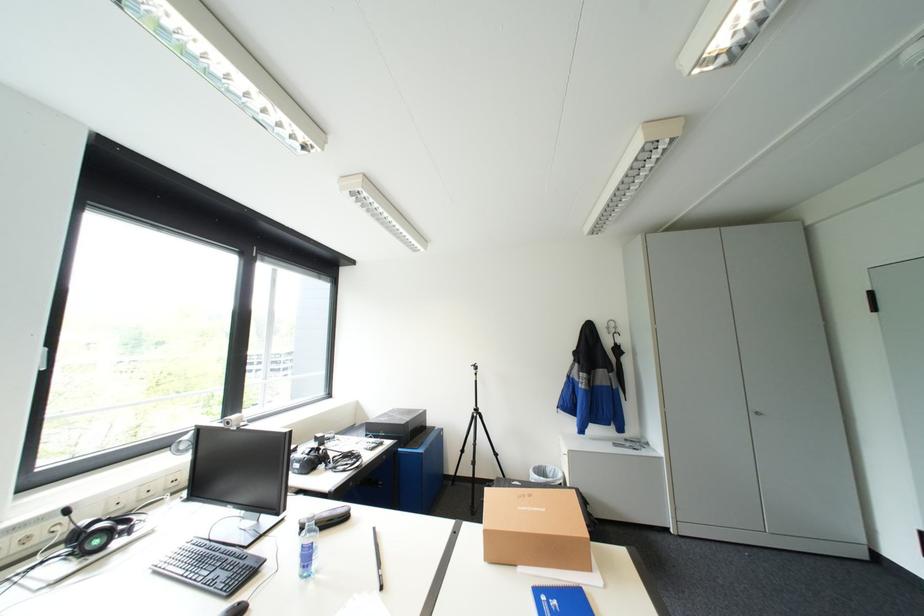
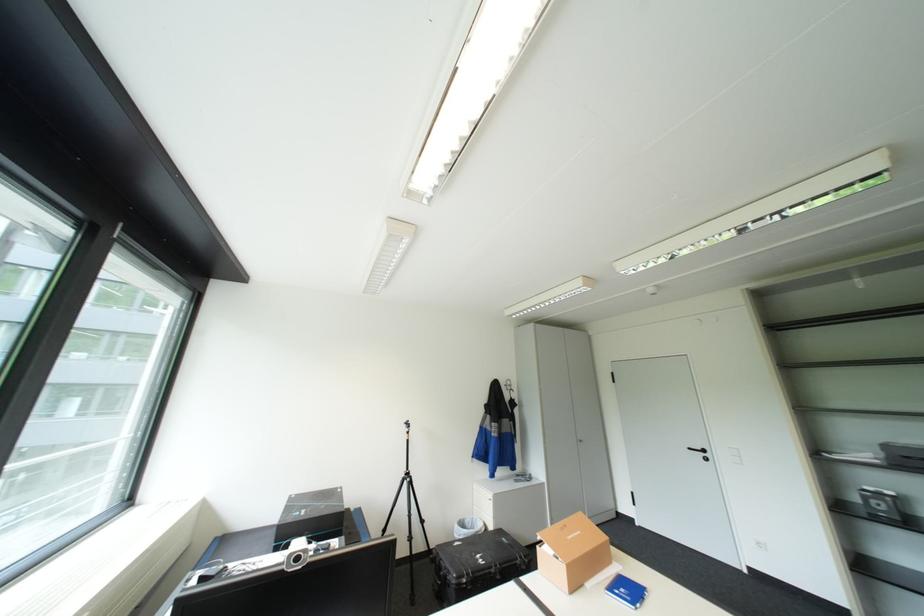
Locate, in the second image, the point that corresponds to [555,468] in the first image.

(475, 521)